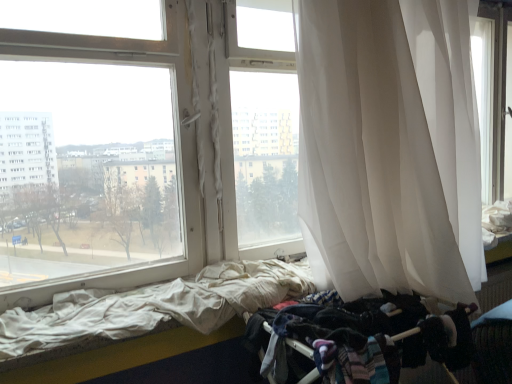
Question: In terms of size, does white sheer curtain at right appear bigger or smaller than white fabric bed at lower left?

Choices:
 (A) big
 (B) small

Answer: (A)

Question: Considering the positions of point (310, 100) and point (214, 347), is point (310, 100) closer or farther from the camera than point (214, 347)?

Choices:
 (A) closer
 (B) farther

Answer: (A)

Question: Based on their relative distances, which object is nearer to the dark fabric baby carriage at lower right?

Choices:
 (A) white sheer curtain at right
 (B) white fabric bed at lower left

Answer: (A)

Question: Considering the real-world distances, which object is closest to the white fabric bed at lower left?

Choices:
 (A) white sheer curtain at right
 (B) dark fabric baby carriage at lower right

Answer: (B)